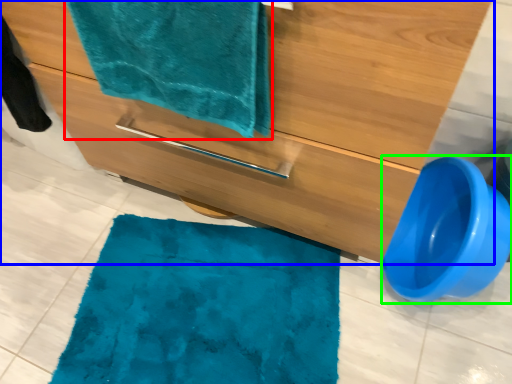
Question: Estimate the real-world distances between objects in this image. Which object is farther from towel (highlighted by a red box), bathroom cabinet (highlighted by a blue box) or toilet bowl (highlighted by a green box)?

Choices:
 (A) bathroom cabinet
 (B) toilet bowl

Answer: (B)